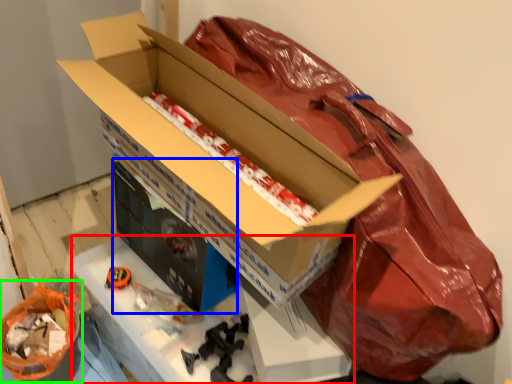
Question: Estimate the real-world distances between objects in this image. Which object is closer to workbench (highlighted by a red box), box (highlighted by a blue box) or wrapping paper (highlighted by a green box)?

Choices:
 (A) box
 (B) wrapping paper

Answer: (A)